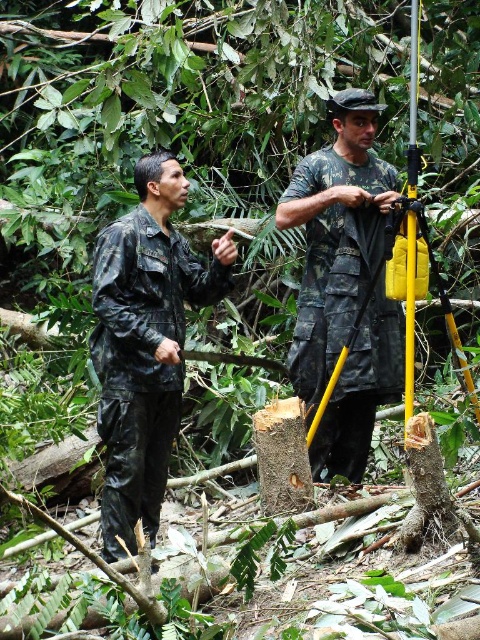
Question: Can you confirm if matte black uniform at center is wider than camouflage fabric shirt at center?

Choices:
 (A) no
 (B) yes

Answer: (B)

Question: Is matte black uniform at center positioned before camouflage fabric shirt at center?

Choices:
 (A) no
 (B) yes

Answer: (B)

Question: Is matte black uniform at center wider than camouflage fabric shirt at center?

Choices:
 (A) no
 (B) yes

Answer: (B)

Question: Among these points, which one is farthest from the camera?

Choices:
 (A) (139, 410)
 (B) (308, 346)

Answer: (B)